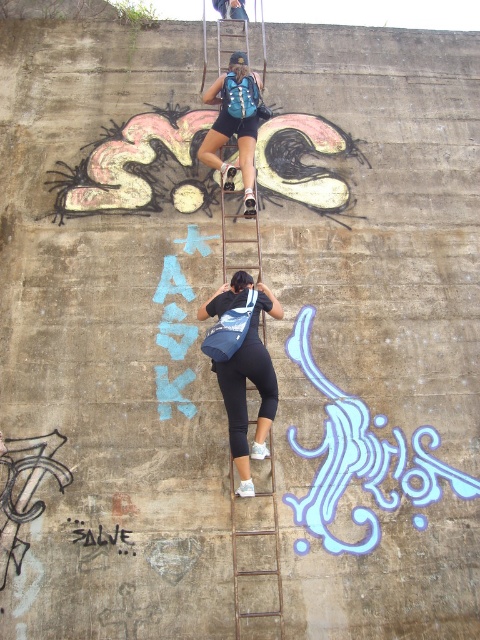
Question: Observing the image, what is the correct spatial positioning of rusty metal ladder at center in reference to blue fabric backpack at center?

Choices:
 (A) above
 (B) below

Answer: (B)

Question: Which point is closer to the camera?

Choices:
 (A) (232, 388)
 (B) (260, 563)

Answer: (B)

Question: Estimate the real-world distances between objects in this image. Which object is farther from the rusty metal ladder at center?

Choices:
 (A) blue fabric backpack at center
 (B) denim bag at center

Answer: (B)

Question: Estimate the real-world distances between objects in this image. Which object is closer to the rusty metal ladder at center?

Choices:
 (A) denim bag at center
 (B) blue fabric backpack at center

Answer: (B)

Question: Does denim bag at center appear over blue fabric backpack at center?

Choices:
 (A) no
 (B) yes

Answer: (A)

Question: From the image, what is the correct spatial relationship of denim bag at center in relation to blue fabric backpack at center?

Choices:
 (A) above
 (B) below

Answer: (B)